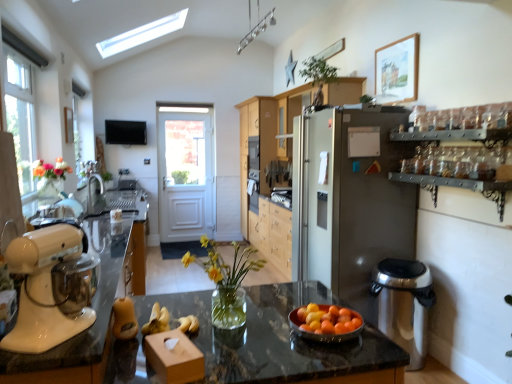
Question: Relative to green leafy plant at upper center, is satin silver coffee machine at right in front or behind?

Choices:
 (A) behind
 (B) front

Answer: (B)

Question: Considering the relative positions of satin silver coffee machine at right and green leafy plant at upper center in the image provided, is satin silver coffee machine at right to the left or to the right of green leafy plant at upper center?

Choices:
 (A) right
 (B) left

Answer: (A)

Question: Which of these objects is positioned farthest from the clear glass window at upper left?

Choices:
 (A) light wood cabinetry at center, which is the second cabinetry from front to back
 (B) metallic glassware at upper right
 (C) satin silver refrigerator at center
 (D) white glossy countertop at left, which is counted as the 1th countertop, starting from the left
 (E) satin silver coffee machine at right

Answer: (E)

Question: Which is nearer to the wooden picture frame at upper right?

Choices:
 (A) white glossy stand mixer at left
 (B) satin silver coffee machine at right
 (C) matte wood cabinet at center, the second cabinetry from the back
 (D) orange matte bowl at center
 (E) light wood cabinetry at center, acting as the first cabinetry starting from the back

Answer: (C)